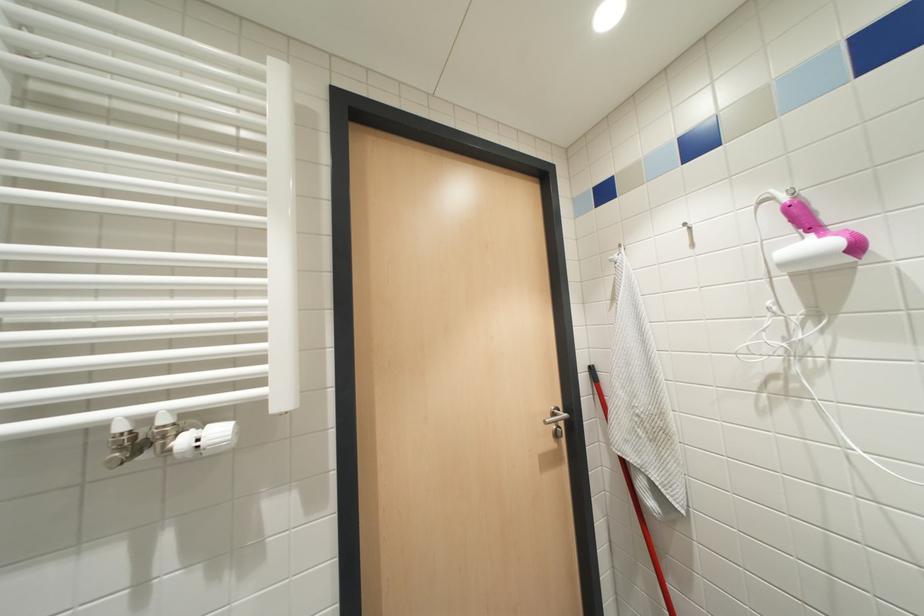
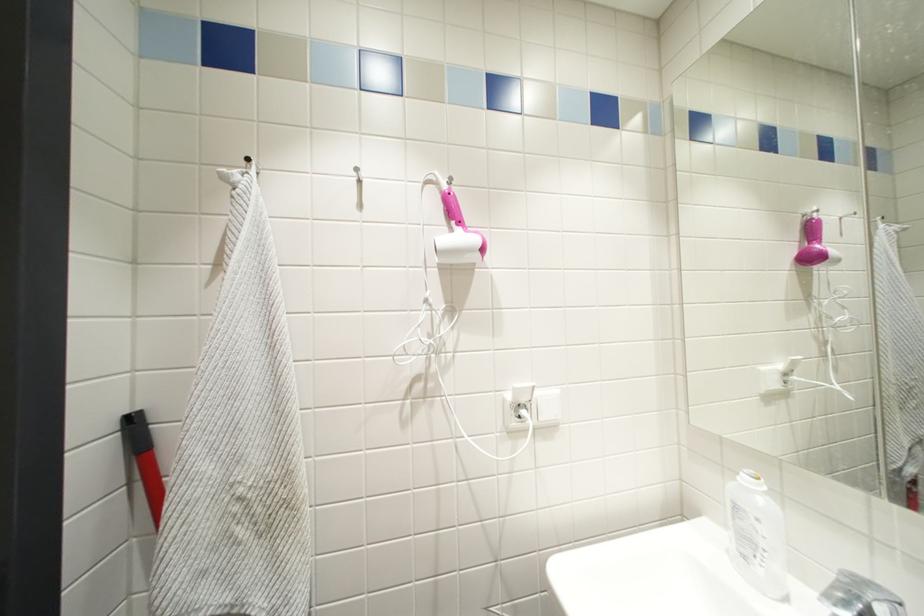
Question: The camera is either moving clockwise (left) or counter-clockwise (right) around the object. The first image is from the beginning of the video and the second image is from the end. Is the camera moving left or right when shooting the video?

Choices:
 (A) Left
 (B) Right

Answer: (A)